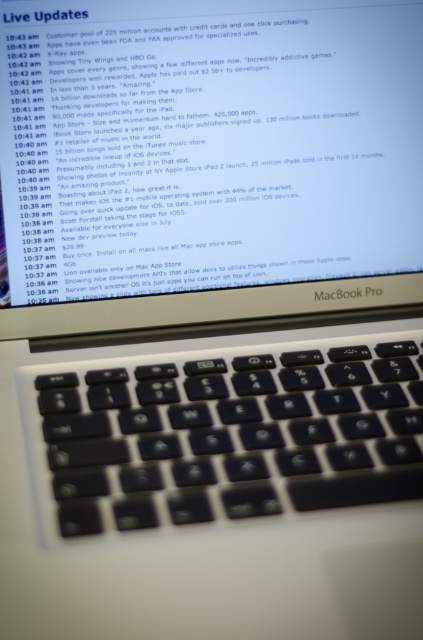
You are a tech journalist who needs to take a photo of the MacBook Pro screen and keyboard for a review article. Since the screen and keyboard are both at center, will the matte black macbook pro at center block the view of the black matte keyboard at center in the photo?

The matte black macbook pro at center is positioned over the black matte keyboard at center, so it will block the view of the keyboard in the photo.

You are a photographer who needs to set up a camera to capture a clear photo of the matte black macbook pro at center. The camera requires a minimum distance of 18 inches to avoid distortion. Based on the scene description, can you position the camera properly?

The matte black macbook pro at center and camera are 17.70 inches apart from each other. Since the required minimum distance is 18 inches, the camera is too close and will cause distortion. Move it back by at least 0.3 inches.

You are setting up a presentation and need to know if the matte black macbook pro at center will fit on a table that can only accommodate items as wide as the black matte keyboard at center. Can it fit?

The matte black macbook pro at center might be wider than the black matte keyboard at center, so it may not fit on the table if the table can only accommodate items as wide as the black matte keyboard at center.